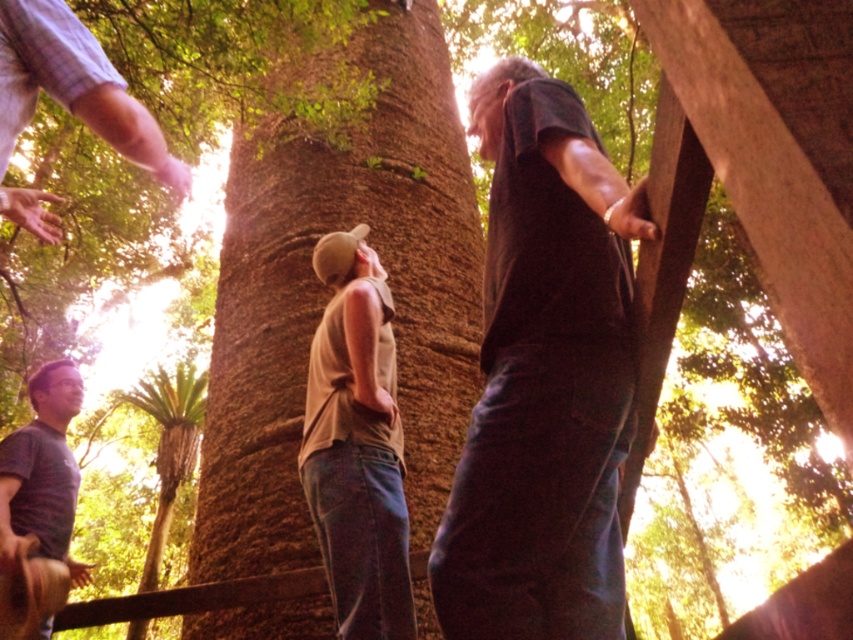
Question: Estimate the real-world distances between objects in this image. Which object is closer to the tan fabric shirt at center?

Choices:
 (A) brown rough bark at center
 (B) dark gray shirt at upper right

Answer: (B)

Question: Which of the following is the farthest from the observer?

Choices:
 (A) (498, 428)
 (B) (282, 385)

Answer: (B)

Question: Is brown rough bark at center below striped cotton shirt at lower left?

Choices:
 (A) no
 (B) yes

Answer: (A)

Question: Which point is farther to the camera?

Choices:
 (A) striped cotton shirt at lower left
 (B) dark gray shirt at upper right
 (C) tan fabric shirt at center

Answer: (A)

Question: Can you confirm if brown rough bark at center is smaller than dark gray shirt at upper right?

Choices:
 (A) no
 (B) yes

Answer: (A)

Question: Is dark gray shirt at upper right positioned behind tan fabric shirt at center?

Choices:
 (A) no
 (B) yes

Answer: (A)